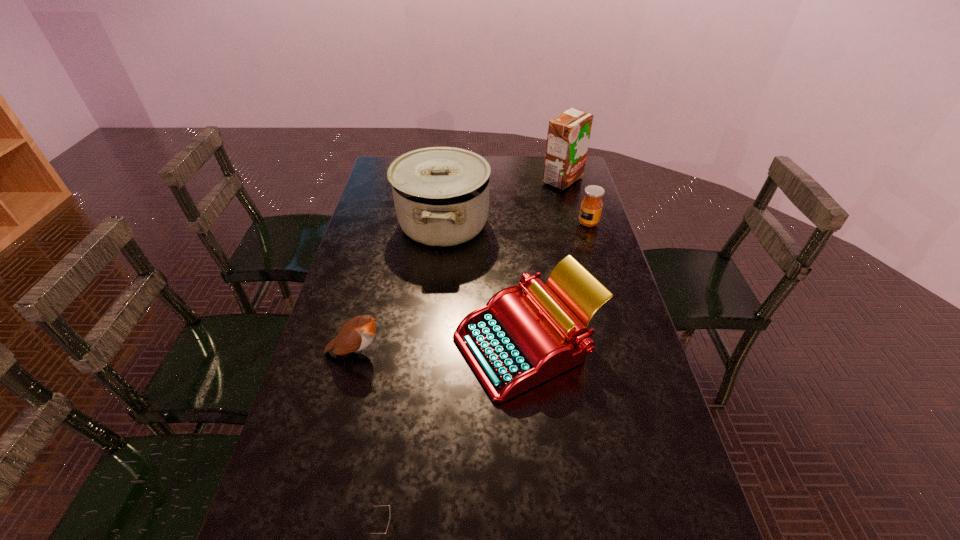
Locate an element on the screen. This screenshot has height=540, width=960. carton is located at coordinates (568, 136).

Locate an element on the screen. This screenshot has width=960, height=540. the fifth shortest object is located at coordinates point(441,194).

You are a GUI agent. You are given a task and a screenshot of the screen. Output one action in this format:
    pyautogui.click(x=<x>, y=<y>)
    Task: Click on the typewriter
    This screenshot has width=960, height=540.
    Given the screenshot: What is the action you would take?
    pyautogui.click(x=518, y=340)

Locate an element on the screen. The image size is (960, 540). honey is located at coordinates (591, 207).

I want to click on bird, so click(356, 334).

Find the location of a particular element. The image size is (960, 540). vacant area located on the straw side of the carton is located at coordinates (490, 180).

Where is `free space located on the straw side of the carton`? free space located on the straw side of the carton is located at coordinates (501, 180).

This screenshot has height=540, width=960. In order to click on free space located 0.120m on the straw side of the carton in this screenshot , I will do `click(513, 180)`.

Where is `free location located on the front of the saucepan`? This screenshot has width=960, height=540. free location located on the front of the saucepan is located at coordinates (435, 298).

Where is `vacant area situated 0.220m on the typing side of the typewriter`? This screenshot has height=540, width=960. vacant area situated 0.220m on the typing side of the typewriter is located at coordinates (373, 345).